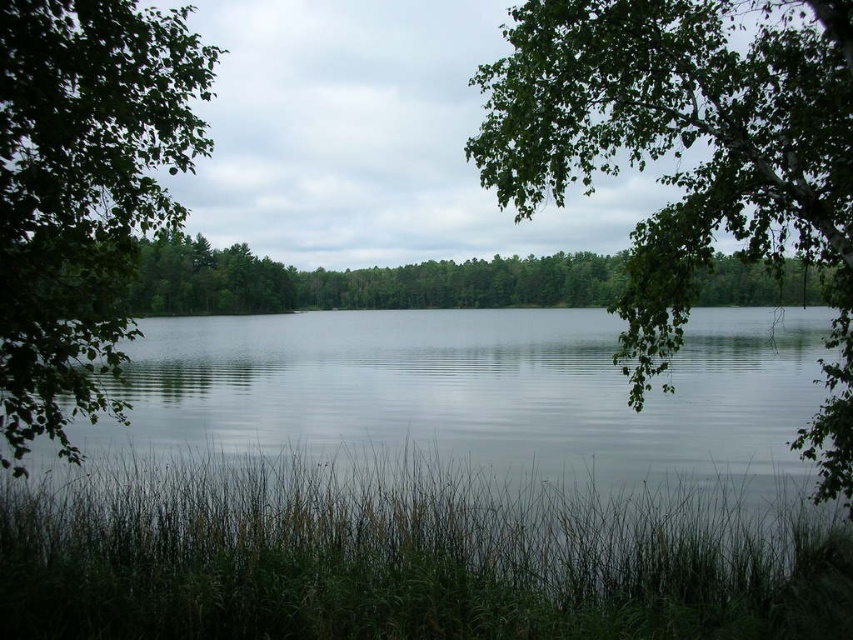
Question: Is green leafy tree at upper right below green leafy tree at left?

Choices:
 (A) no
 (B) yes

Answer: (A)

Question: Does clear water at center appear over green leafy tree at upper right?

Choices:
 (A) no
 (B) yes

Answer: (A)

Question: Is clear water at center to the left of green leafy tree at left from the viewer's perspective?

Choices:
 (A) no
 (B) yes

Answer: (A)

Question: Which point is farther from the camera taking this photo?

Choices:
 (A) click(18, 189)
 (B) click(573, 403)
 (C) click(596, 68)

Answer: (B)

Question: Which object appears farthest from the camera in this image?

Choices:
 (A) green leafy tree at left
 (B) green leafy tree at upper right
 (C) clear water at center

Answer: (C)

Question: Which point appears farthest from the camera in this image?

Choices:
 (A) (120, 250)
 (B) (482, 448)

Answer: (B)